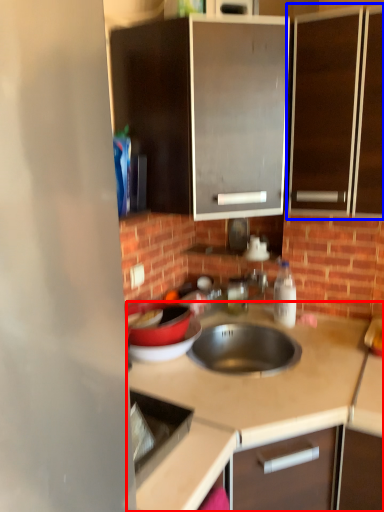
Question: Which object is further to the camera taking this photo, countertop (highlighted by a red box) or cabinetry (highlighted by a blue box)?

Choices:
 (A) countertop
 (B) cabinetry

Answer: (B)